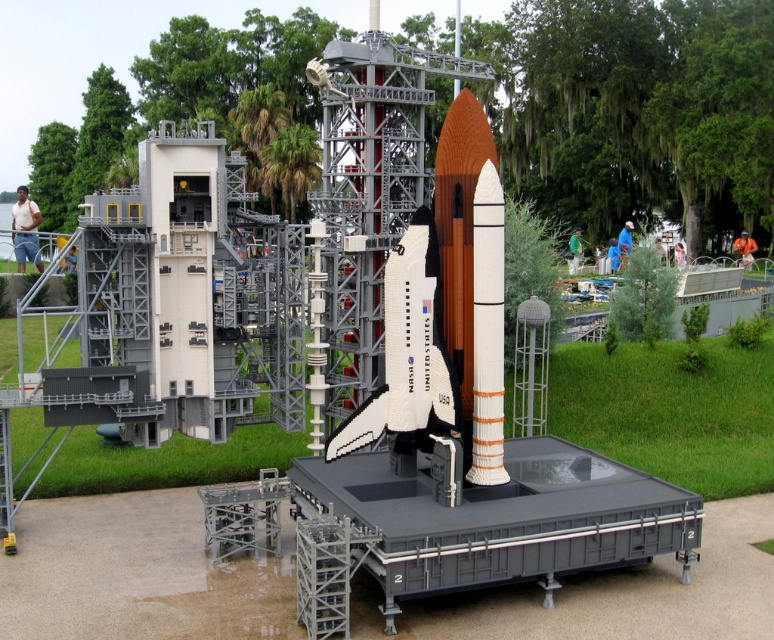
You are a GUI agent. You are given a task and a screenshot of the screen. Output one action in this format:
    pyautogui.click(x=<x>, y=<y>)
    Task: Click on the white plastic rocket at center
    Image resolution: width=774 pixels, height=640 pixels.
    Given the screenshot: What is the action you would take?
    pyautogui.click(x=406, y=356)

Who is lower down, white plastic rocket at center or metallic gray lift at center?

Positioned lower is white plastic rocket at center.

Is point (406, 387) positioned after point (677, 292)?

That is False.

The height and width of the screenshot is (640, 774). In order to click on white plastic rocket at center in this screenshot , I will do `click(406, 356)`.

Does brick orange rocket at center have a greater width compared to metallic gray lift at center?

Incorrect, brick orange rocket at center's width does not surpass metallic gray lift at center's.

Locate an element on the screen. The height and width of the screenshot is (640, 774). brick orange rocket at center is located at coordinates (471, 278).

Locate an element on the screen. brick orange rocket at center is located at coordinates (471, 278).

What do you see at coordinates (471, 278) in the screenshot? I see `brick orange rocket at center` at bounding box center [471, 278].

Between point (468, 236) and point (399, 467), which one is positioned behind?

Positioned behind is point (399, 467).

Locate an element on the screen. brick orange rocket at center is located at coordinates (471, 278).